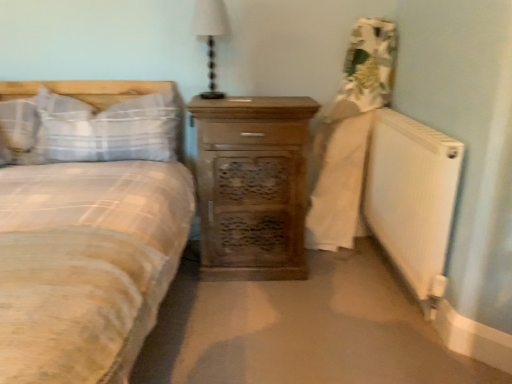
Where is `free space in front of white fabric lampshade at upper center`? This screenshot has height=384, width=512. free space in front of white fabric lampshade at upper center is located at coordinates (218, 102).